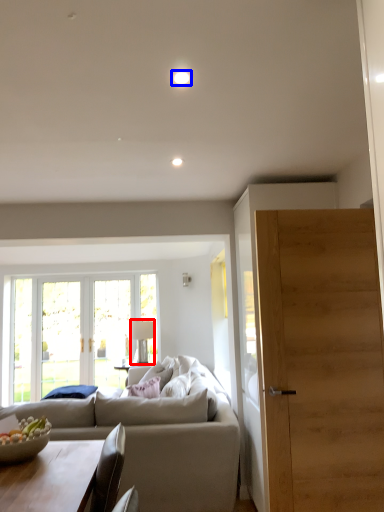
Question: Which of the following is the farthest to the observer, lamp (highlighted by a red box) or light (highlighted by a blue box)?

Choices:
 (A) lamp
 (B) light

Answer: (A)